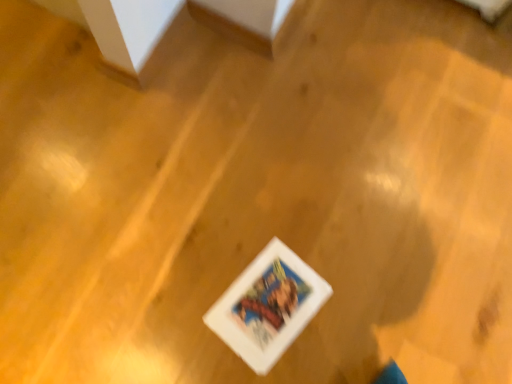
Find the location of `free point above white paper at center (from a real-world perspective)`. free point above white paper at center (from a real-world perspective) is located at coordinates (267, 302).